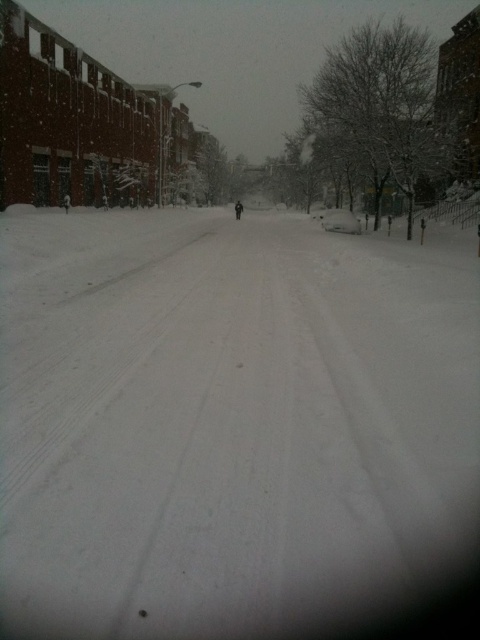
You are a delivery drone with a wingspan of 1.2 meters. You need to fly from the white powdery snow at center to the black matte person at center. Can you safely navigate the path between them without any obstacles?

The distance between white powdery snow at center and black matte person at center is 37.33 meters. Since there are no obstacles mentioned in the scene description, the drone can safely navigate the path between them as long as the weather conditions allow for flight.

You are a delivery robot with a width of 0.8 meters. You need to navigate through the snowy street scene. The white powdery snow at center and the black matte person at center are in your path. Can you pass between them without going off the path?

The white powdery snow at center might be wider than the black matte person at center, so there is a possibility that the space between them is sufficient for the robot to pass through. However, since the exact width isn

You are standing on the snowy street and want to take a photo of the black matte person at center without including the white powdery snow at center in the frame. Is this possible based on their positions?

The white powdery snow at center is closer to the viewer than the black matte person at center. Therefore, to exclude the snow from the photo, you would need to adjust your angle or position so that the person is framed without the snow being in front of them. However, since the snow is at the center and closer, it might be challenging unless you move to a position where the person is no longer behind the snow in your field of view.